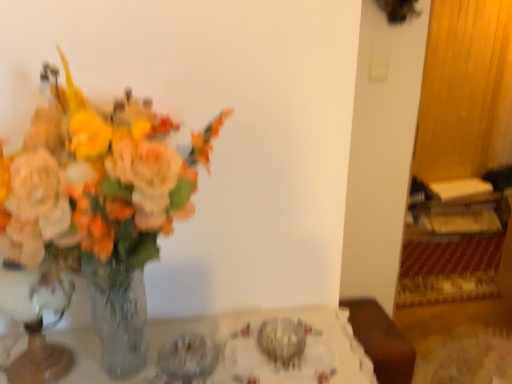
Question: Is clear glass vase at left at the left side of translucent glass vase at left?

Choices:
 (A) no
 (B) yes

Answer: (A)

Question: From a real-world perspective, is clear glass vase at left physically below translucent glass vase at left?

Choices:
 (A) yes
 (B) no

Answer: (A)

Question: Does clear glass vase at left have a greater width compared to translucent glass vase at left?

Choices:
 (A) no
 (B) yes

Answer: (A)

Question: Is clear glass vase at left not near translucent glass vase at left?

Choices:
 (A) yes
 (B) no

Answer: (B)

Question: Is clear glass vase at left surrounding translucent glass vase at left?

Choices:
 (A) no
 (B) yes

Answer: (A)

Question: Is clear glass vase at left completely or partially outside of translucent glass vase at left?

Choices:
 (A) yes
 (B) no

Answer: (A)

Question: From a real-world perspective, is clear glass vase at left below clear glass vase at left?

Choices:
 (A) no
 (B) yes

Answer: (A)

Question: Considering the relative sizes of clear glass vase at left and clear glass vase at left in the image provided, is clear glass vase at left thinner than clear glass vase at left?

Choices:
 (A) no
 (B) yes

Answer: (B)

Question: Can we say clear glass vase at left lies outside clear glass vase at left?

Choices:
 (A) yes
 (B) no

Answer: (A)

Question: Is the depth of clear glass vase at left greater than that of clear glass vase at left?

Choices:
 (A) yes
 (B) no

Answer: (B)

Question: Is clear glass vase at left far away from clear glass vase at left?

Choices:
 (A) yes
 (B) no

Answer: (B)

Question: Considering the relative positions of clear glass vase at left and clear glass vase at left in the image provided, is clear glass vase at left to the right of clear glass vase at left from the viewer's perspective?

Choices:
 (A) yes
 (B) no

Answer: (B)

Question: From the image's perspective, is translucent glass vase at left beneath clear glass vase at left?

Choices:
 (A) no
 (B) yes

Answer: (A)